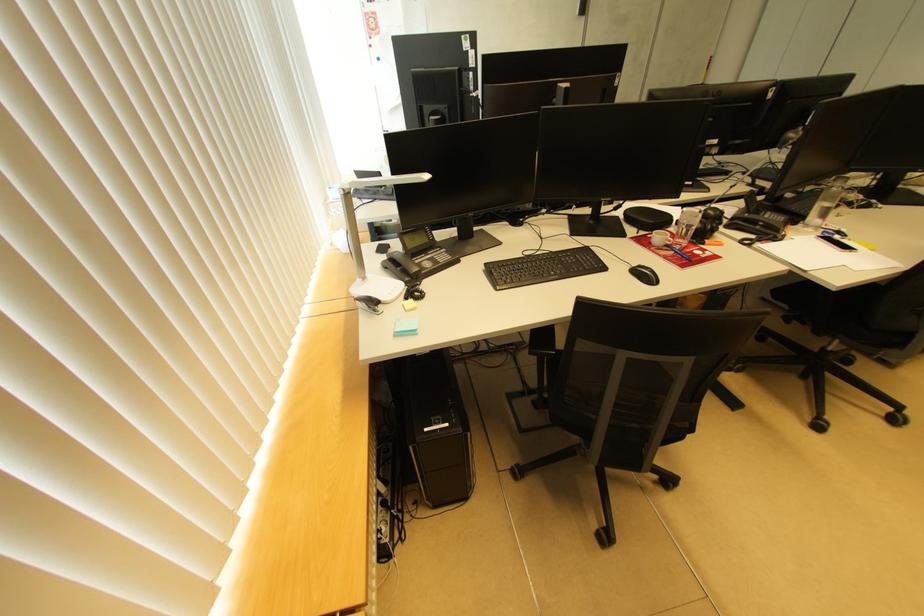
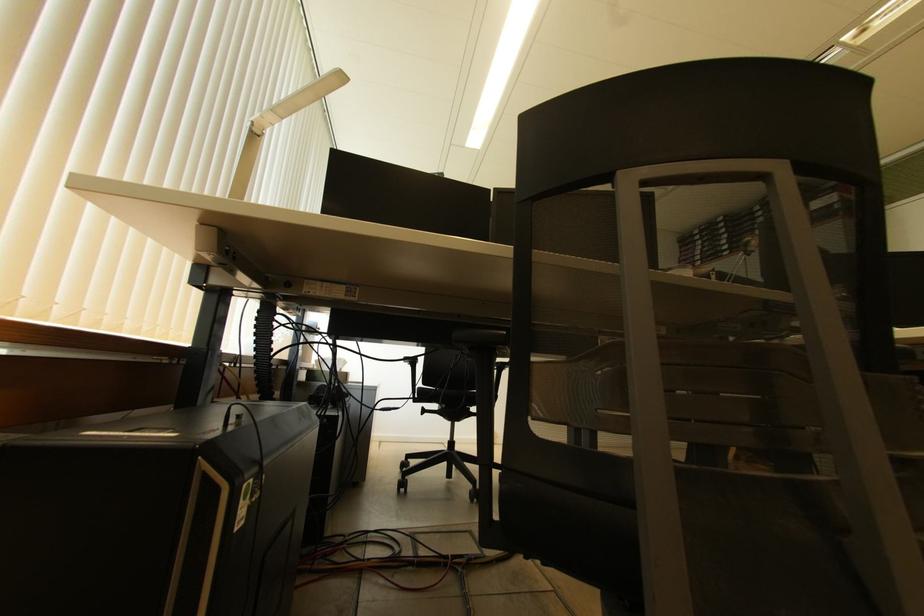
Question: Based on the continuous images, in which direction is the camera rotating? Reply with the corresponding letter.

Choices:
 (A) Left
 (B) Right
 (C) Up
 (D) Down

Answer: (C)